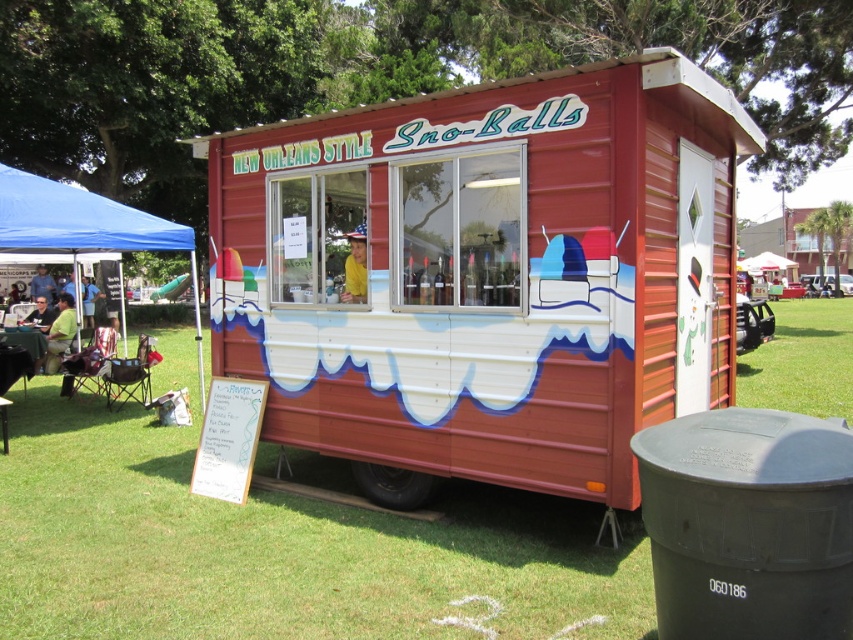
You are a customer looking at the trailer and want to know if the green fabric shirt at lower left is taller than the brushed metal water at bottle left. Based on the scene, can you determine this?

The green fabric shirt at lower left is not as tall as brushed metal water at bottle left, so the shirt is shorter.

You are a customer waiting in line at the metallic red food truck at center. You want to find shade to wait. Is the blue fabric tent at left behind or in front of the food truck?

The metallic red food truck at center is in front of the blue fabric tent at left, so the tent is behind the food truck and not accessible from your current position.